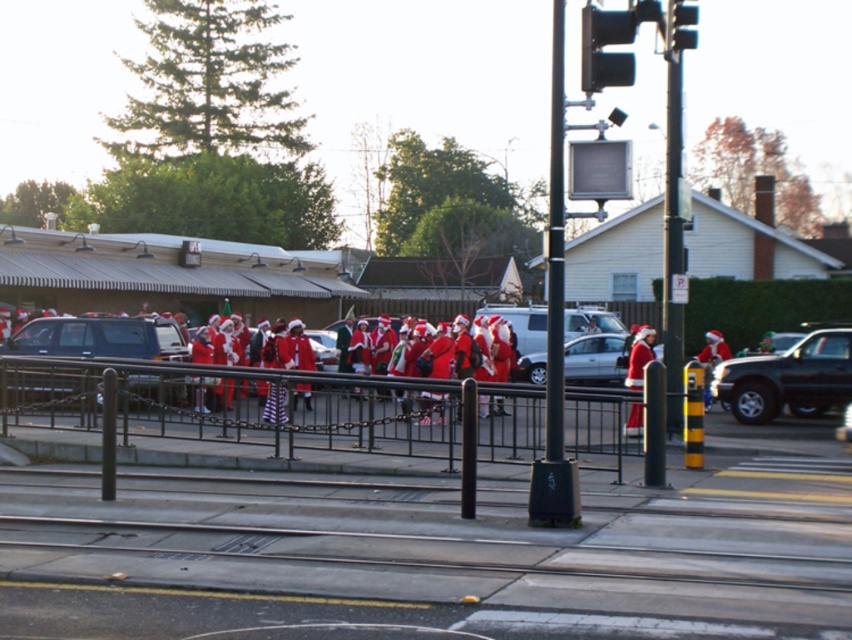
Question: Among these objects, which one is nearest to the camera?

Choices:
 (A) matte red santa suit at center
 (B) silver metallic sedan at center
 (C) black metal railing at center
 (D) black plastic traffic light at upper right

Answer: (C)

Question: Is black metal railing at center further to camera compared to black plastic traffic light at upper center?

Choices:
 (A) no
 (B) yes

Answer: (B)

Question: Which of the following is the farthest from the observer?

Choices:
 (A) silver metallic sedan at center
 (B) black metal railing at center

Answer: (A)

Question: Does black metal railing at center appear under black plastic traffic light at upper center?

Choices:
 (A) yes
 (B) no

Answer: (A)

Question: Is black metal railing at center smaller than shiny black truck at right?

Choices:
 (A) no
 (B) yes

Answer: (A)

Question: Which object appears farthest from the camera in this image?

Choices:
 (A) black plastic traffic light at upper right
 (B) black plastic traffic light at upper center
 (C) matte black suv at left
 (D) shiny black truck at right

Answer: (C)